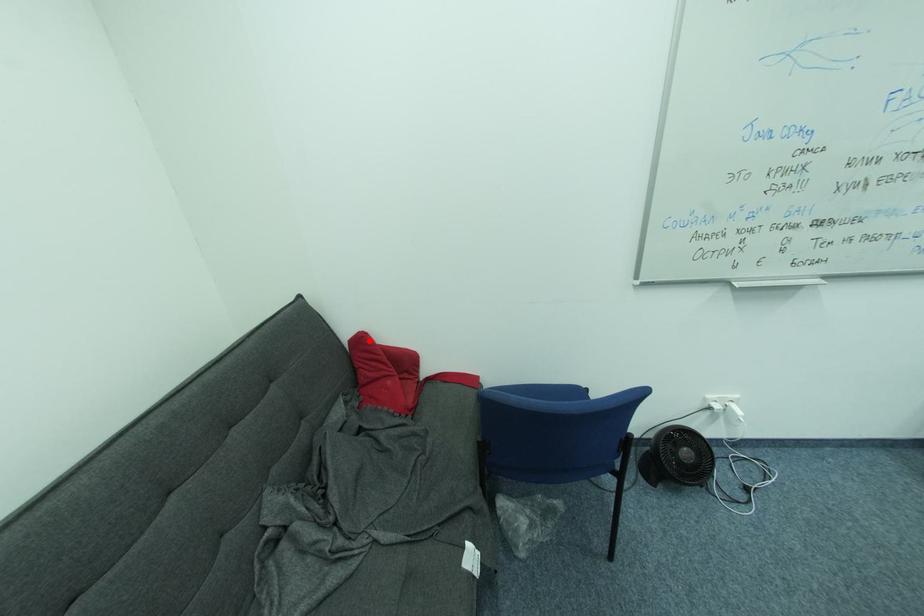
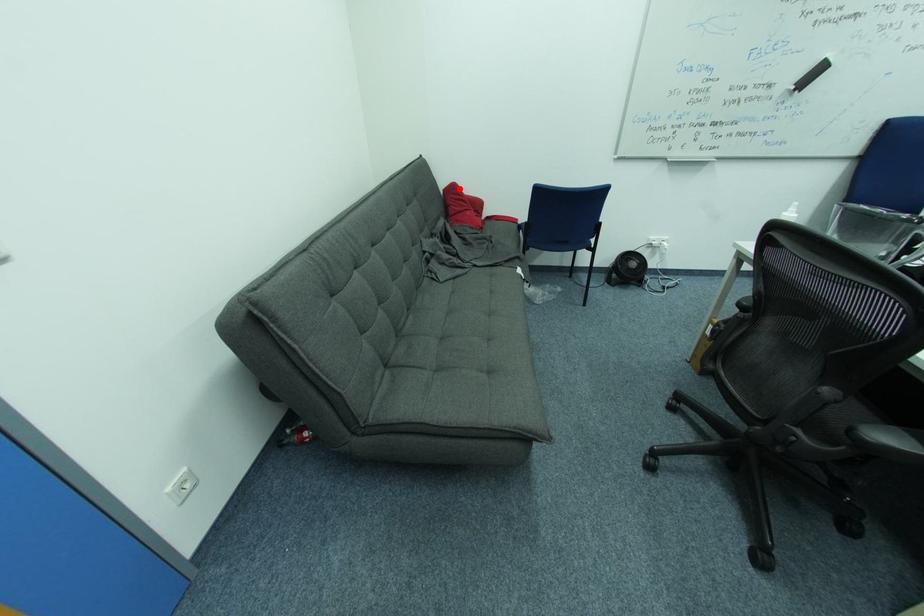
I am providing you with two images of the same scene from different viewpoints. A red point is marked on the first image and another point is marked on the second image. Are the points marked in image1 and image2 representing the same 3D position?

Yes